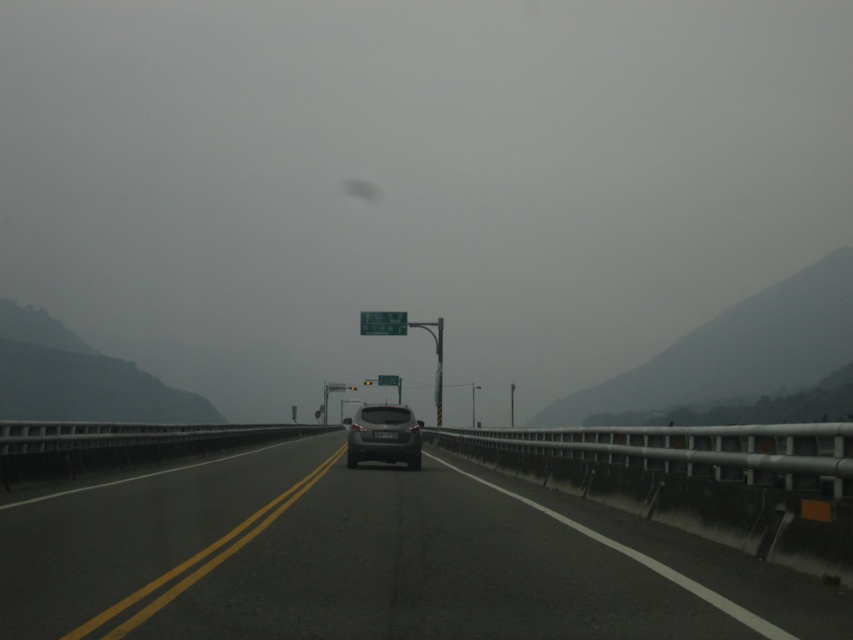
The width and height of the screenshot is (853, 640). Identify the location of transparent glass windshield at center. (413, 180).

Consider the image. Is transparent glass windshield at center closer to camera compared to satin black suv at center?

No, transparent glass windshield at center is behind satin black suv at center.

You are a GUI agent. You are given a task and a screenshot of the screen. Output one action in this format:
    pyautogui.click(x=<x>, y=<y>)
    Task: Click on the transparent glass windshield at center
    
    Given the screenshot: What is the action you would take?
    pyautogui.click(x=413, y=180)

Is transparent glass windshield at center shorter than green plastic sign at center?

In fact, transparent glass windshield at center may be taller than green plastic sign at center.

Which is in front, point (3, 227) or point (363, 314)?

Positioned in front is point (363, 314).

In order to click on transparent glass windshield at center in this screenshot , I will do `click(413, 180)`.

Between gray matte fog at right and green plastic street sign at center, which one is positioned higher?

green plastic street sign at center is higher up.

Can you confirm if gray matte fog at right is positioned to the left of green plastic street sign at center?

Incorrect, gray matte fog at right is not on the left side of green plastic street sign at center.

Is point (778, 324) positioned behind point (389, 381)?

Yes, point (778, 324) is farther from viewer.

This screenshot has width=853, height=640. In order to click on gray matte fog at right in this screenshot , I will do `click(735, 349)`.